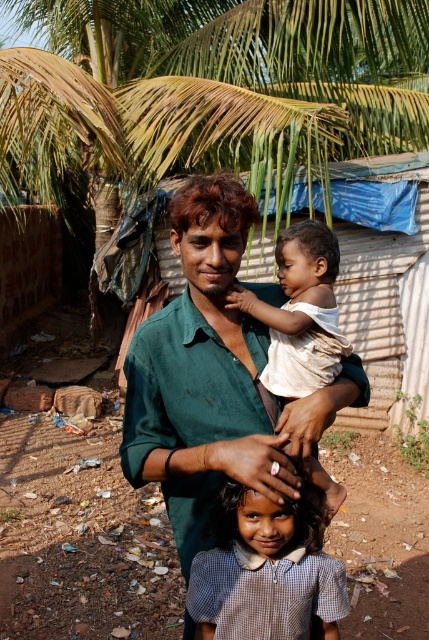
Which of these two, green cotton shirt at center or white cotton shirt at center, stands taller?

Standing taller between the two is green cotton shirt at center.

Does green cotton shirt at center lie behind white cotton shirt at center?

No.

Does point (148, 438) come farther from viewer compared to point (293, 392)?

No.

Identify the location of green cotton shirt at center. This screenshot has width=429, height=640. (217, 381).

Which is behind, point (192, 292) or point (260, 557)?

Point (192, 292)

Is point (301, 426) in front of point (323, 516)?

Yes.

What are the coordinates of `green cotton shirt at center` in the screenshot? It's located at (217, 381).

Between point (199, 552) and point (325, 372), which one is positioned behind?

Point (325, 372)

Between light blue checkered shirt at center and white cotton shirt at center, which one is positioned lower?

light blue checkered shirt at center

Between point (268, 611) and point (295, 310), which one is positioned behind?

The point (295, 310) is behind.

At what (x,y) coordinates should I click in order to perform the action: click on light blue checkered shirt at center. Please return your answer as a coordinate pair (x, y). The image size is (429, 640). Looking at the image, I should click on (263, 570).